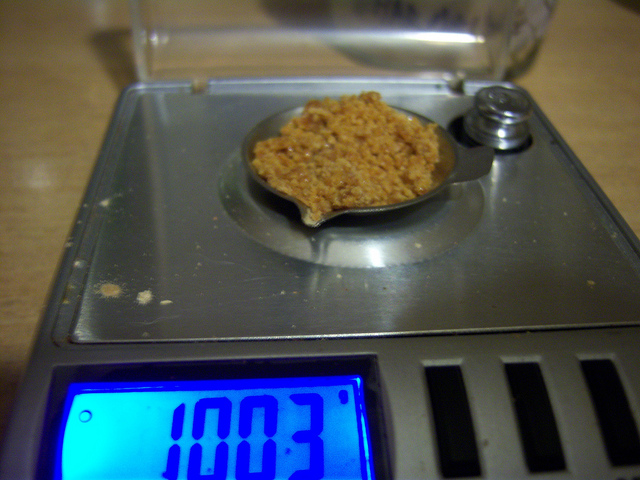
Where is `silver knob`? silver knob is located at coordinates (504, 112).